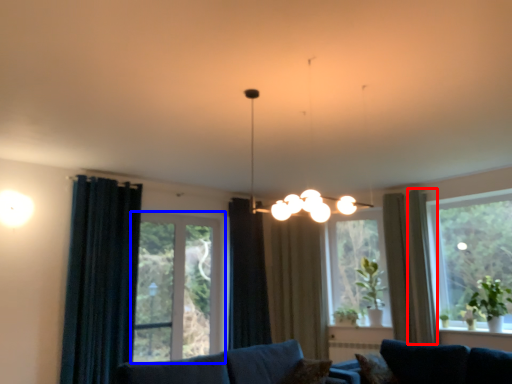
Question: Among these objects, which one is nearest to the camera, curtain (highlighted by a red box) or window (highlighted by a blue box)?

Choices:
 (A) curtain
 (B) window

Answer: (B)